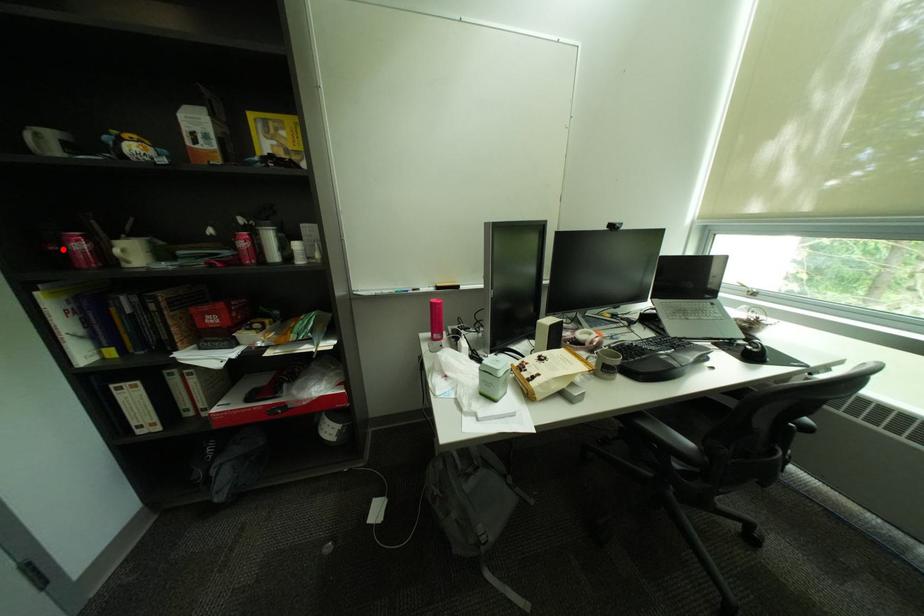
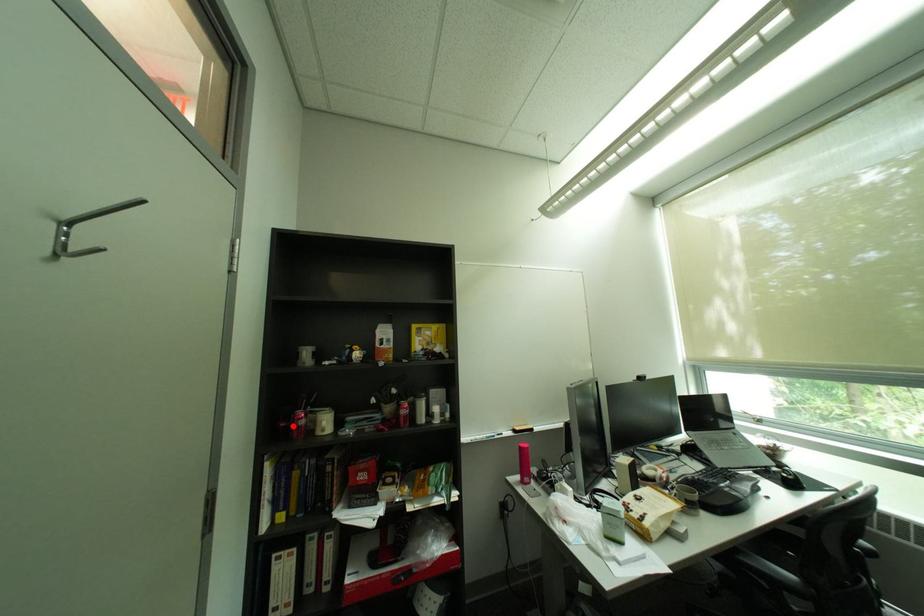
I am providing you with two images of the same scene from different viewpoints. A red point is marked on the first image and another point is marked on the second image. Is the red point in image1 aligned with the point shown in image2?

Yes